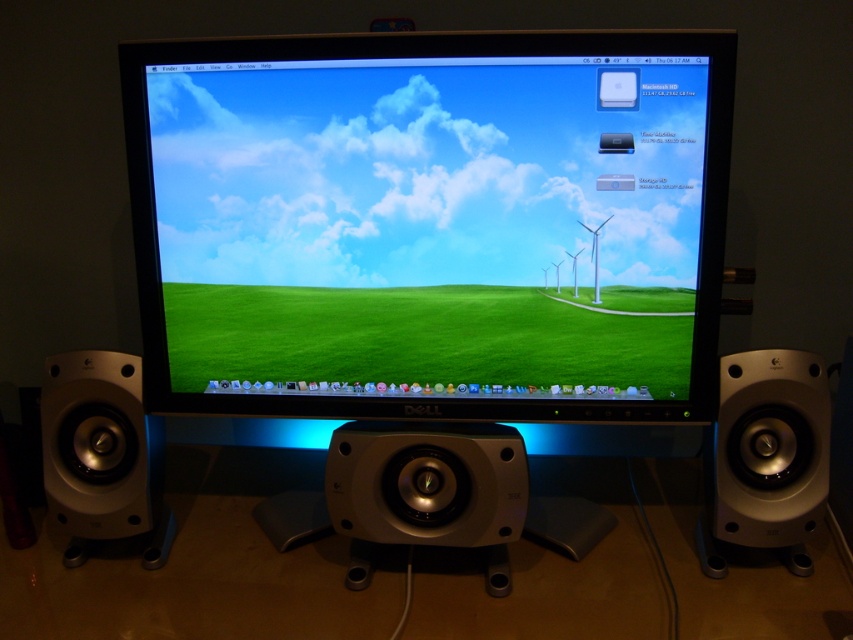
Between silver metallic speaker at right and silver metallic speaker at left, which one appears on the left side from the viewer's perspective?

silver metallic speaker at left is more to the left.

Between point (705, 458) and point (80, 557), which one is positioned behind?

Point (705, 458)

Find the location of a particular element. The image size is (853, 640). silver metallic speaker at right is located at coordinates (764, 458).

Which is in front, point (590, 340) or point (811, 566)?

Point (811, 566) is in front.

Between matte plastic monitor at center and silver metallic speaker at right, which one is positioned higher?

Positioned higher is matte plastic monitor at center.

Does point (509, 93) come behind point (770, 492)?

No, it is in front of (770, 492).

The width and height of the screenshot is (853, 640). What are the coordinates of `matte plastic monitor at center` in the screenshot? It's located at (430, 225).

Does matte plastic monitor at center have a larger size compared to silver metallic speaker at left?

Correct, matte plastic monitor at center is larger in size than silver metallic speaker at left.

The height and width of the screenshot is (640, 853). I want to click on matte plastic monitor at center, so click(430, 225).